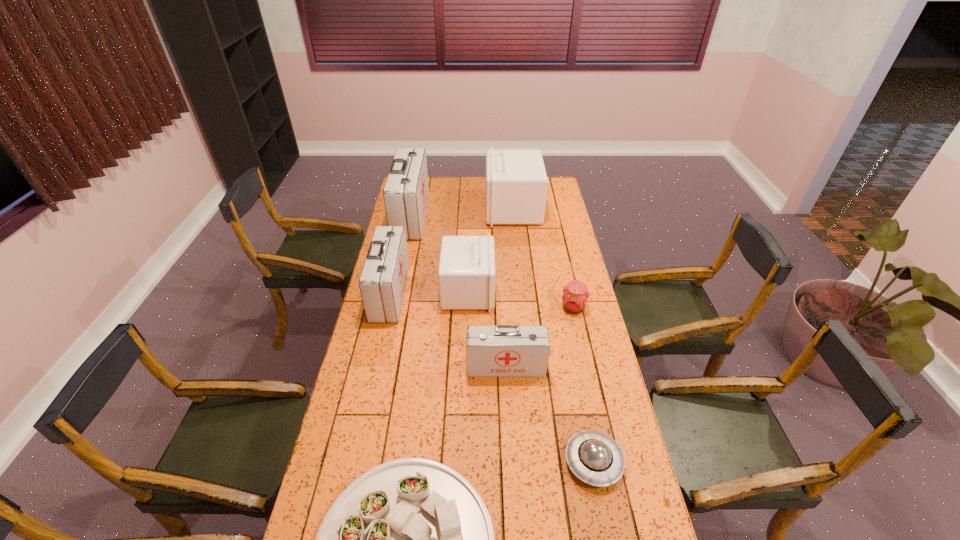
Locate an element on the screen. The height and width of the screenshot is (540, 960). the third closest object to the platter is located at coordinates (382, 282).

You are a GUI agent. You are given a task and a screenshot of the screen. Output one action in this format:
    pyautogui.click(x=<x>, y=<y>)
    Task: Click on the object that is the fourth closest to the shortest first-aid kit
    Image resolution: width=960 pixels, height=540 pixels.
    Given the screenshot: What is the action you would take?
    pyautogui.click(x=411, y=539)

At what (x,y) coordinates should I click in order to perform the action: click on the first-aid kit that is the third closest one to the nearer white first-aid kit. Please return your answer as a coordinate pair (x, y). Image resolution: width=960 pixels, height=540 pixels. Looking at the image, I should click on (406, 191).

Where is `the third closest first-aid kit to the white platter`? This screenshot has width=960, height=540. the third closest first-aid kit to the white platter is located at coordinates (466, 275).

Locate an element on the screen. red first-aid kit that stands as the closest to the smallest red first-aid kit is located at coordinates (382, 282).

Where is `the second closest red first-aid kit to the farthest red first-aid kit`? the second closest red first-aid kit to the farthest red first-aid kit is located at coordinates (503, 350).

Locate an element on the screen. The width and height of the screenshot is (960, 540). free location that satisfies the following two spatial constraints: 1. on the front-facing side of the second biggest red first-aid kit; 2. on the right side of the saucer is located at coordinates (352, 462).

Image resolution: width=960 pixels, height=540 pixels. Identify the location of free location that satisfies the following two spatial constraints: 1. on the front-facing side of the smaller white first-aid kit; 2. on the right side of the saucer. (464, 462).

The height and width of the screenshot is (540, 960). Find the location of `vacant space that satisfies the following two spatial constraints: 1. on the front-facing side of the sixth tallest object; 2. on the left side of the smaller white first-aid kit`. vacant space that satisfies the following two spatial constraints: 1. on the front-facing side of the sixth tallest object; 2. on the left side of the smaller white first-aid kit is located at coordinates pyautogui.click(x=468, y=308).

This screenshot has height=540, width=960. I want to click on vacant space that satisfies the following two spatial constraints: 1. on the front-facing side of the second smallest red first-aid kit; 2. on the back side of the red jam, so click(387, 308).